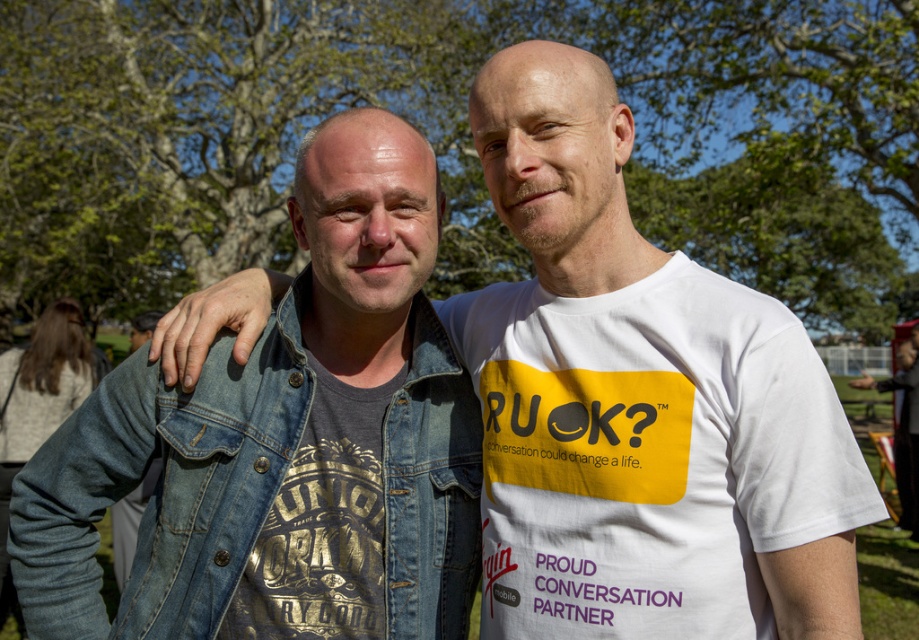
Does point (834, 412) lie behind point (28, 481)?

No, it is in front of (28, 481).

Is white cotton t-shirt at upper center taller than denim jacket at left?

Correct, white cotton t-shirt at upper center is much taller as denim jacket at left.

What do you see at coordinates (649, 454) in the screenshot? I see `white cotton t-shirt at upper center` at bounding box center [649, 454].

Locate an element on the screen. The width and height of the screenshot is (919, 640). white cotton t-shirt at upper center is located at coordinates (649, 454).